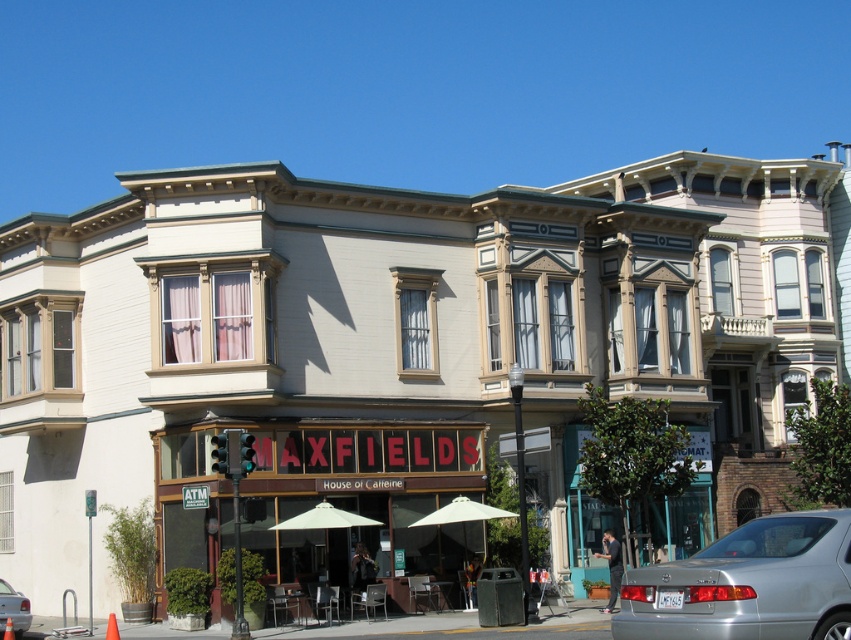
You are standing at the entrance of the building and want to locate the matte red sign at center. According to the coordinates provided, where exactly is it positioned?

The matte red sign at center is located at point 0.783 on the x axis and 0.430 on the y axis.